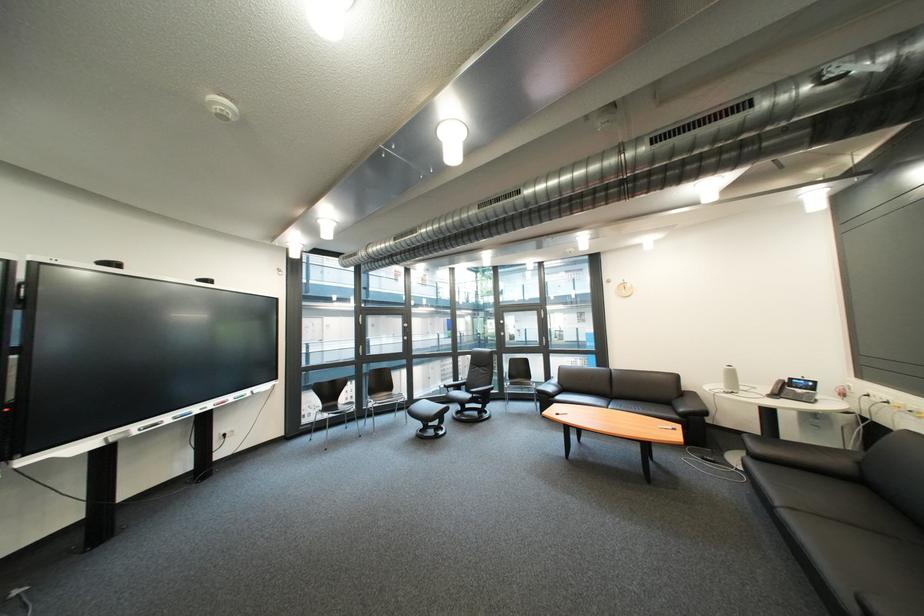
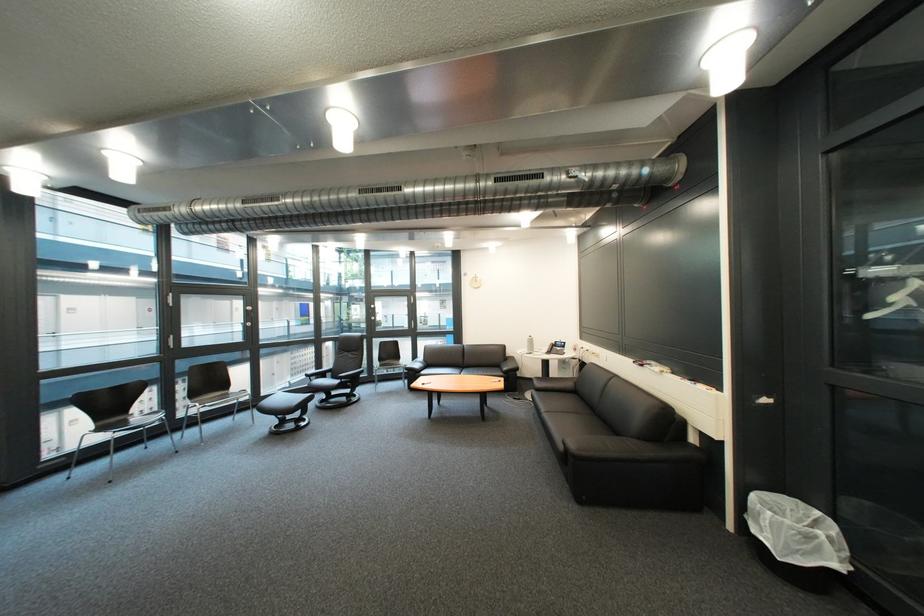
Question: The camera is either moving clockwise (left) or counter-clockwise (right) around the object. The first image is from the beginning of the video and the second image is from the end. Is the camera moving left or right when shooting the video?

Choices:
 (A) Left
 (B) Right

Answer: (A)